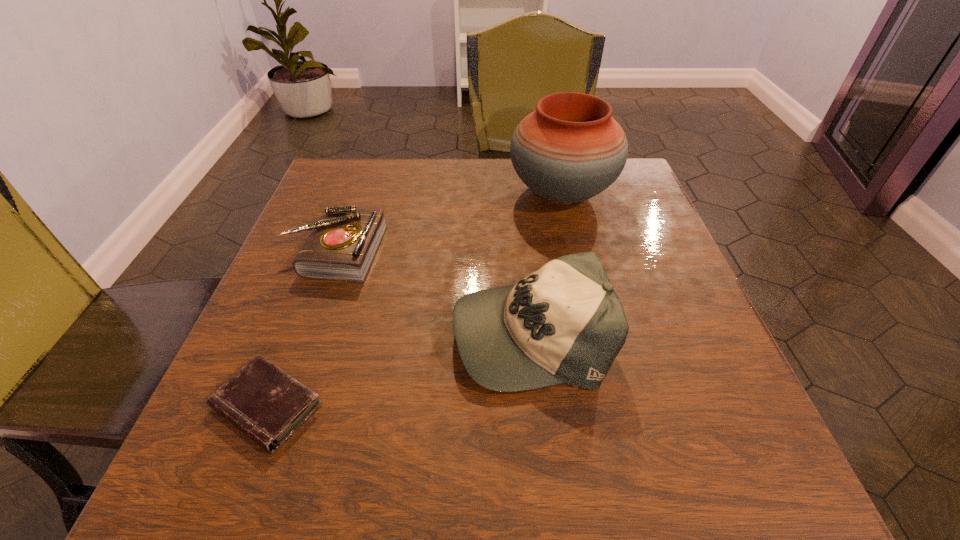
Identify the location of free space at the right edge of the desktop. (623, 295).

Where is `free point at the far left corner`? The image size is (960, 540). free point at the far left corner is located at coordinates (389, 158).

You are a GUI agent. You are given a task and a screenshot of the screen. Output one action in this format:
    pyautogui.click(x=<x>, y=<y>)
    Task: Click on the vacant area at the far right corner
    The image size is (960, 540).
    Given the screenshot: What is the action you would take?
    pyautogui.click(x=633, y=167)

Find the location of a particular element. Image resolution: width=960 pixels, height=540 pixels. free point at the near right corner is located at coordinates tap(652, 453).

This screenshot has height=540, width=960. In order to click on free space between the tallest object and the baseball cap in this screenshot , I will do `click(545, 263)`.

This screenshot has width=960, height=540. I want to click on vacant region between the nearer diary and the third tallest object, so coord(301,328).

The height and width of the screenshot is (540, 960). I want to click on free space that is in between the third shortest object and the farther diary, so click(433, 292).

Identify the location of free spot between the tallest object and the shortest object. (415, 300).

Locate an element on the screen. This screenshot has width=960, height=540. vacant region between the shorter diary and the tallest object is located at coordinates (415, 300).

Locate an element on the screen. The width and height of the screenshot is (960, 540). free space between the second shortest object and the nearer diary is located at coordinates (301, 328).